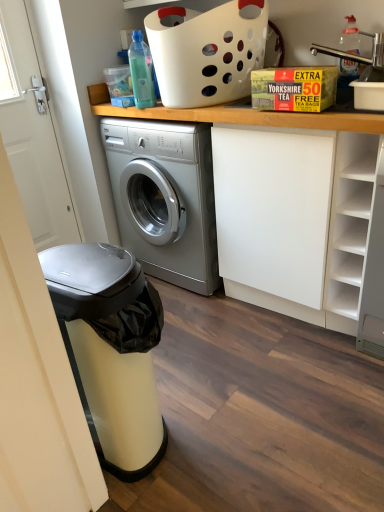
Identify the location of free spot to the right of metallic stainless steel dishwasher at left. (x=231, y=418).